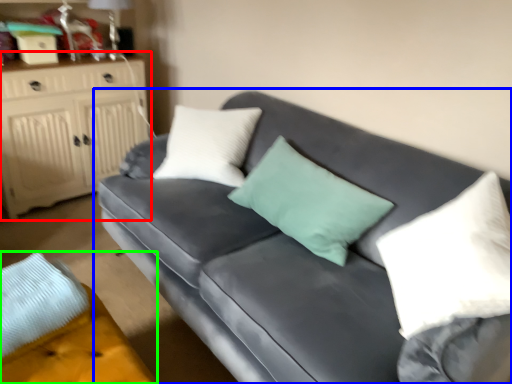
Question: Which object is positioned farthest from cabinetry (highlighted by a red box)? Select from studio couch (highlighted by a blue box) and footrest (highlighted by a green box).

Choices:
 (A) studio couch
 (B) footrest

Answer: (B)